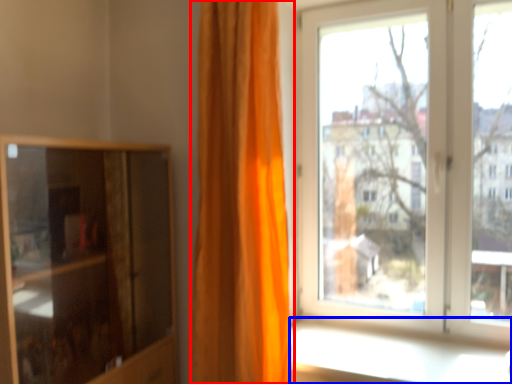
Question: Which object is closer to the camera taking this photo, curtain (highlighted by a red box) or window sill (highlighted by a blue box)?

Choices:
 (A) curtain
 (B) window sill

Answer: (B)